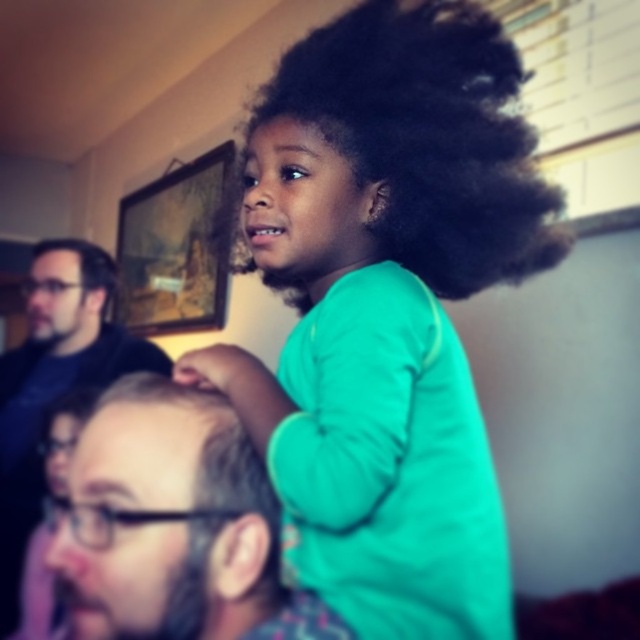
You are standing in the room and want to place a small decoration on the wall between the two points labeled point (259, 134) and point (81, 248). Which point should you choose if you want the decoration to be closer to you?

You should choose point (259, 134) because it is closer to the viewer than point (81, 248).

You are a photographer trying to capture a group photo. You see the matte black hair at upper center and the wooden framed artwork at upper left in the background. To ensure both are visible in your shot, which one should you adjust your camera to focus on first?

You should focus on the wooden framed artwork at upper left first because the matte black hair at upper center is positioned to its right, meaning the artwork is further away and needs to be in focus first to capture both elements clearly.

You are a photographer trying to capture a candid shot of the scene. You need to focus on the black curly hair at upper center and the black matte shirt at left. Which object should you adjust your camera focus to first if you want to ensure both are in focus?

The black curly hair at upper center is located above the black matte shirt at left, so you should focus on the black curly hair at upper center first since it is closer to the camera.